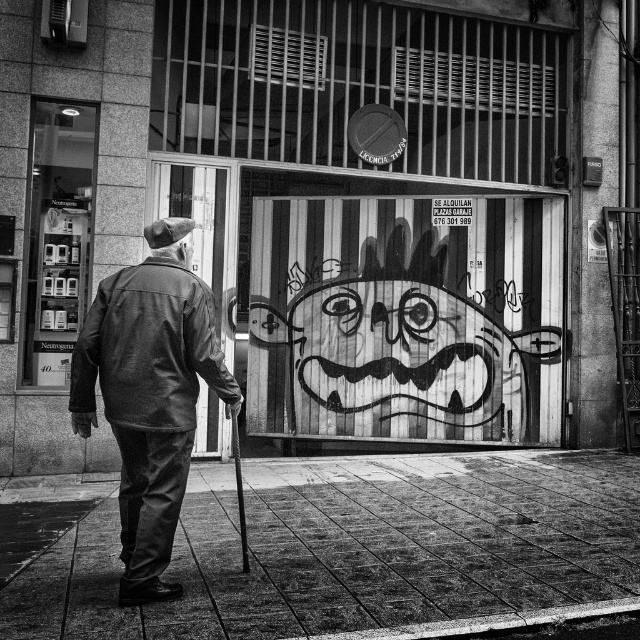
You are a delivery person who needs to place a package on the smooth concrete pavement at center. However, there is a leather jacket at center in the way. Can you move the jacket to access the pavement?

The leather jacket at center is behind the smooth concrete pavement at center, so you can access the pavement without moving the jacket.

You are an architect analyzing the perspective of this urban scene. You notice two points in the image at coordinates point (360, 627) and point (179, 396). Based on their positions, which point is located closer to the viewer?

Point (360, 627) is closer to the viewer than point (179, 396).